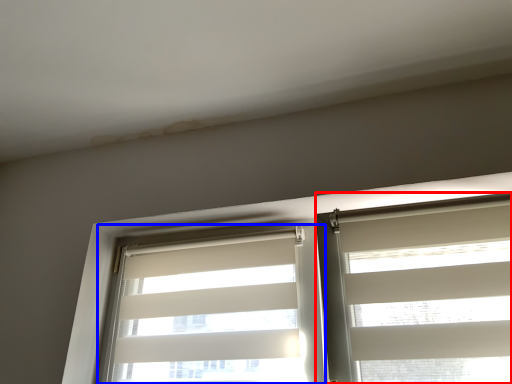
Question: Among these objects, which one is nearest to the camera, window blind (highlighted by a red box) or window blind (highlighted by a blue box)?

Choices:
 (A) window blind
 (B) window blind

Answer: (A)